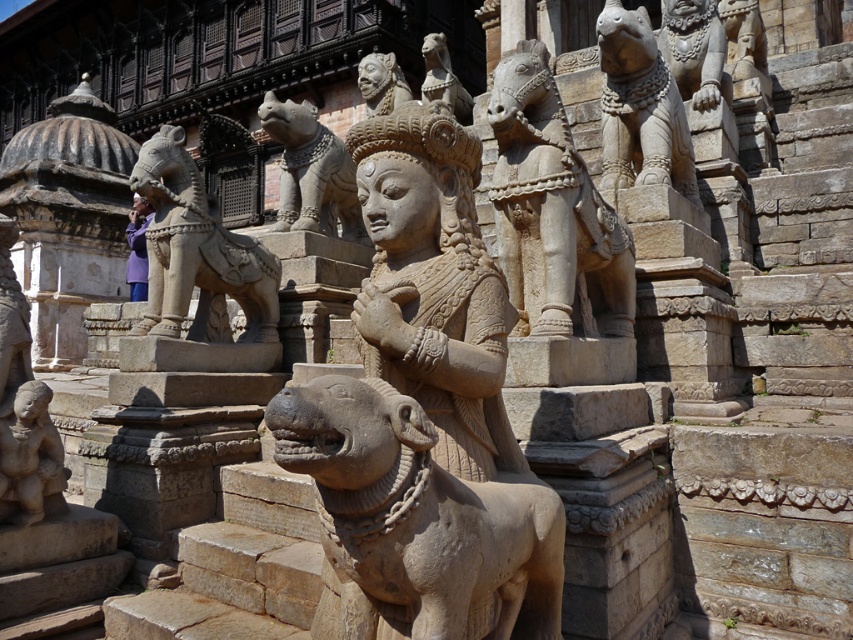
Can you confirm if carved stone horse at upper center is positioned to the right of stone lion at center?

Indeed, carved stone horse at upper center is positioned on the right side of stone lion at center.

Does carved stone horse at upper center appear over stone lion at center?

Indeed, carved stone horse at upper center is positioned over stone lion at center.

The width and height of the screenshot is (853, 640). I want to click on carved stone horse at upper center, so tap(550, 209).

Identify the location of carved stone horse at upper center. (550, 209).

Between brown stone dog at center and stone lion at upper center, which one has more height?

Standing taller between the two is brown stone dog at center.

Can you confirm if brown stone dog at center is taller than stone lion at upper center?

Indeed, brown stone dog at center has a greater height compared to stone lion at upper center.

Between point (350, 566) and point (345, 182), which one is positioned behind?

The point (345, 182) is behind.

You are a GUI agent. You are given a task and a screenshot of the screen. Output one action in this format:
    pyautogui.click(x=<x>, y=<y>)
    Task: Click on the brown stone dog at center
    The height and width of the screenshot is (640, 853).
    Given the screenshot: What is the action you would take?
    pyautogui.click(x=416, y=522)

Based on the photo, does smooth stone statue at center lie in front of stone lion at upper right?

That is True.

Is point (469, 360) more distant than point (627, 186)?

No, it is in front of (627, 186).

At what (x,y) coordinates should I click in order to perform the action: click on smooth stone statue at center. Please return your answer as a coordinate pair (x, y). Looking at the image, I should click on (434, 284).